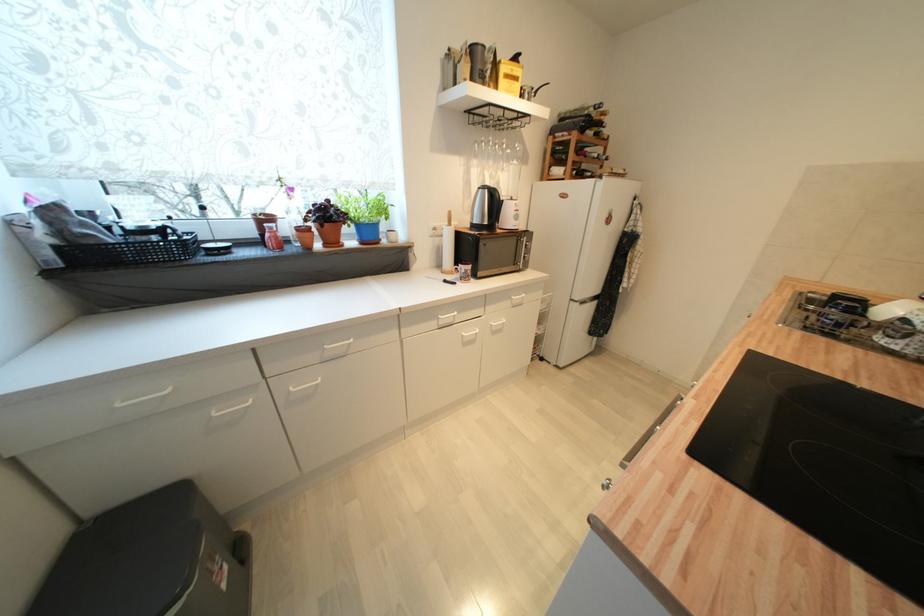
This screenshot has height=616, width=924. What do you see at coordinates (590, 302) in the screenshot?
I see `the refrigerator door handle` at bounding box center [590, 302].